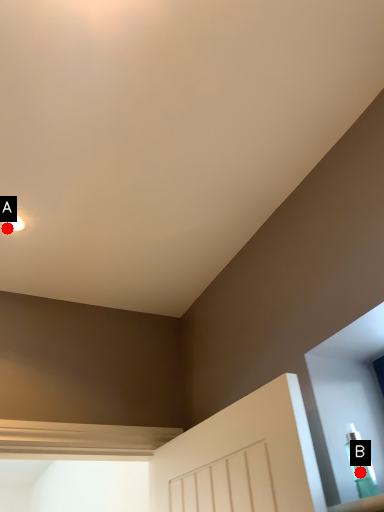
Question: Two points are circled on the image, labeled by A and B beside each circle. Which point is closer to the camera?

Choices:
 (A) A is closer
 (B) B is closer

Answer: (B)